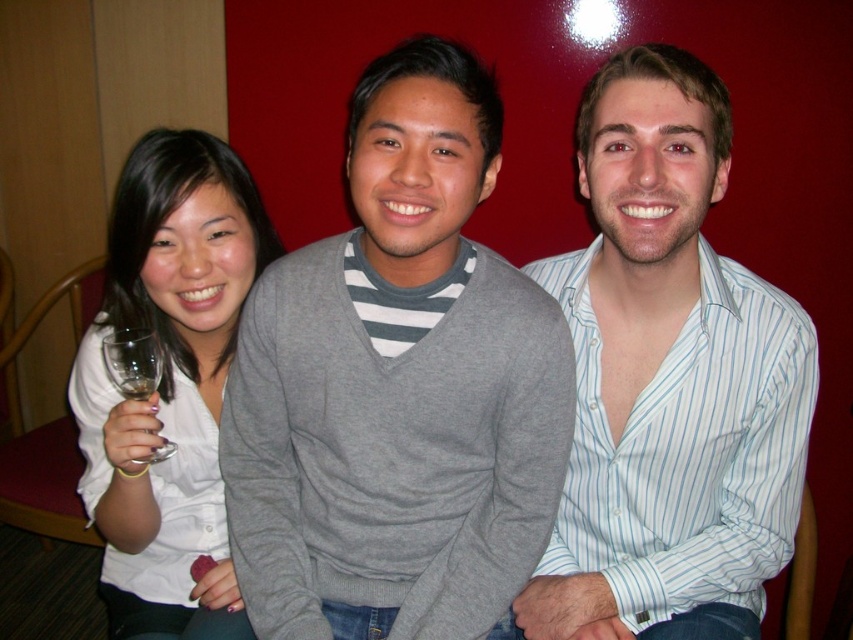
Question: Does gray sweater at center have a larger size compared to clear glass wine glass at lower left?

Choices:
 (A) yes
 (B) no

Answer: (A)

Question: Which object is farther from the camera taking this photo?

Choices:
 (A) gray sweater at center
 (B) white matte shirt at left
 (C) white striped shirt at center
 (D) clear glass at lower left

Answer: (D)

Question: Is gray sweater at center below clear glass wine glass at lower left?

Choices:
 (A) no
 (B) yes

Answer: (A)

Question: Which point appears closest to the camera in this image?

Choices:
 (A) (137, 346)
 (B) (335, 310)
 (C) (679, 454)
 (D) (115, 342)

Answer: (B)

Question: Considering the real-world distances, which object is farthest from the gray sweater at center?

Choices:
 (A) white matte shirt at left
 (B) white striped shirt at center

Answer: (A)

Question: Does clear glass wine glass at lower left appear under clear glass at lower left?

Choices:
 (A) yes
 (B) no

Answer: (A)